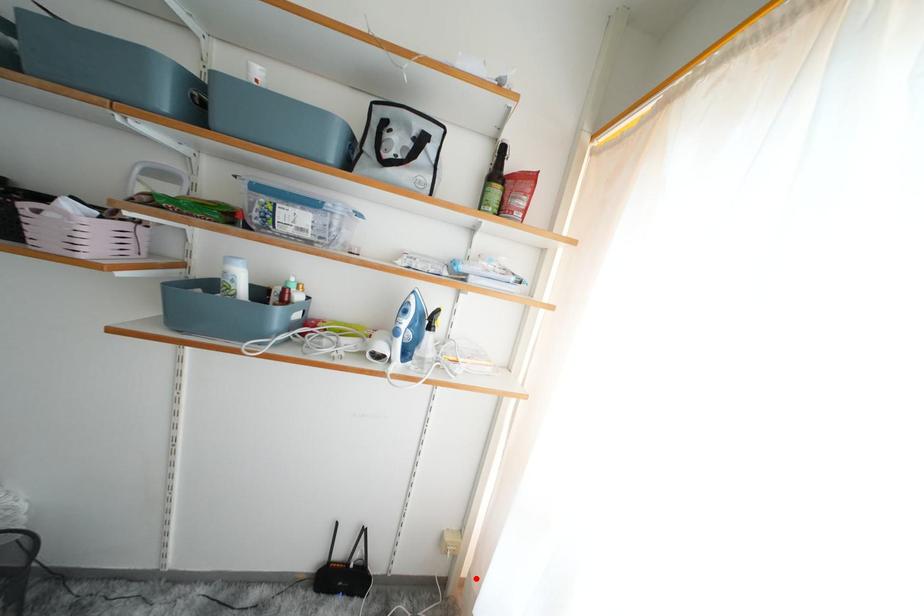
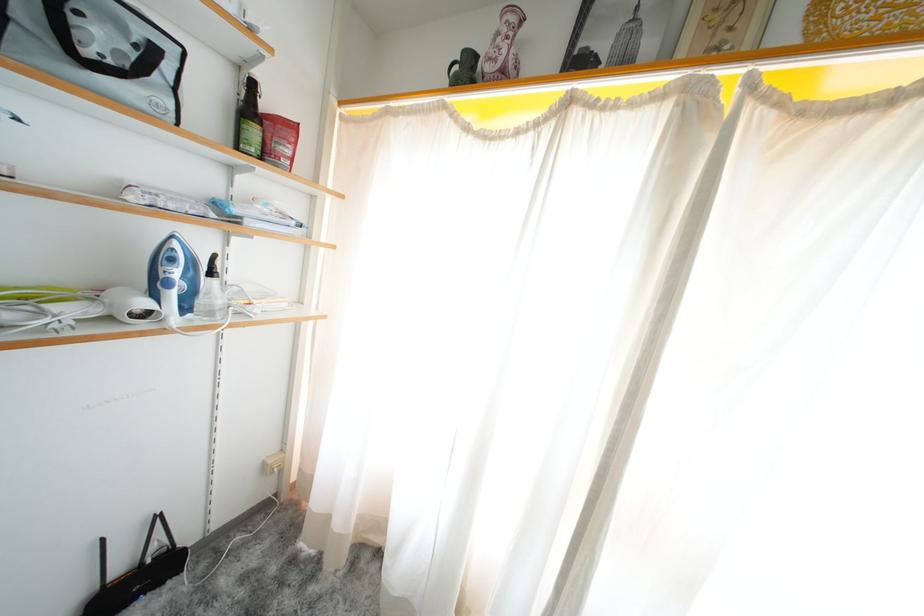
Question: I am providing you with two images of the same scene from different viewpoints. In image1, a red point is highlighted. Considering the same 3D point in image2, which of the following is correct?

Choices:
 (A) It is closer
 (B) It is farther

Answer: (B)